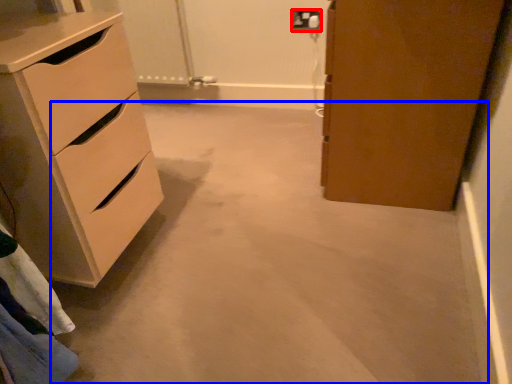
Question: Among these objects, which one is nearest to the camera, electric outlet (highlighted by a red box) or concrete (highlighted by a blue box)?

Choices:
 (A) electric outlet
 (B) concrete

Answer: (B)